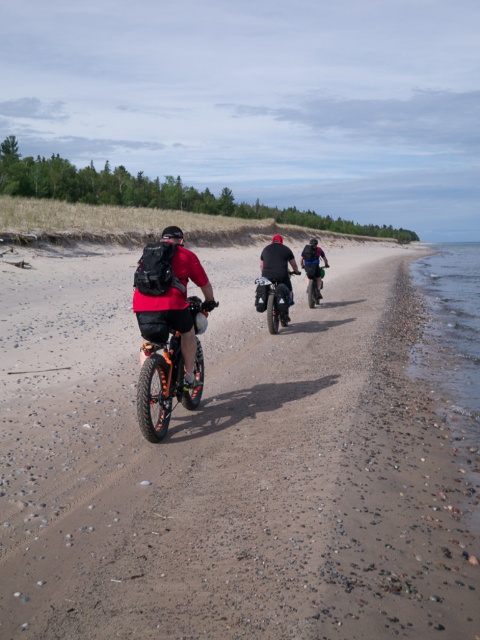
Does orange matte bicycle at center have a smaller size compared to shiny black dirt bike at center?

No.

Is orange matte bicycle at center to the left of shiny black dirt bike at center from the viewer's perspective?

Correct, you'll find orange matte bicycle at center to the left of shiny black dirt bike at center.

Describe the element at coordinates (165, 384) in the screenshot. The height and width of the screenshot is (640, 480). I see `orange matte bicycle at center` at that location.

Where is `orange matte bicycle at center`? orange matte bicycle at center is located at coordinates (165, 384).

Which is above, brown gravelly sand at center or shiny black dirt bike at center?

brown gravelly sand at center is above.

Consider the image. Who is more forward, (126, 595) or (261, 288)?

Point (126, 595) is in front.

Between point (262, 513) and point (285, 296), which one is positioned behind?

The point (285, 296) is behind.

This screenshot has height=640, width=480. In order to click on brown gravelly sand at center in this screenshot , I will do `click(242, 484)`.

Who is taller, orange matte bicycle at center or green matte dirt bike at center?

Standing taller between the two is orange matte bicycle at center.

Based on the photo, does orange matte bicycle at center appear on the right side of green matte dirt bike at center?

In fact, orange matte bicycle at center is to the left of green matte dirt bike at center.

Who is more distant from viewer, (182, 380) or (314, 268)?

The point (314, 268) is behind.

Where is `orange matte bicycle at center`? The height and width of the screenshot is (640, 480). orange matte bicycle at center is located at coordinates (165, 384).